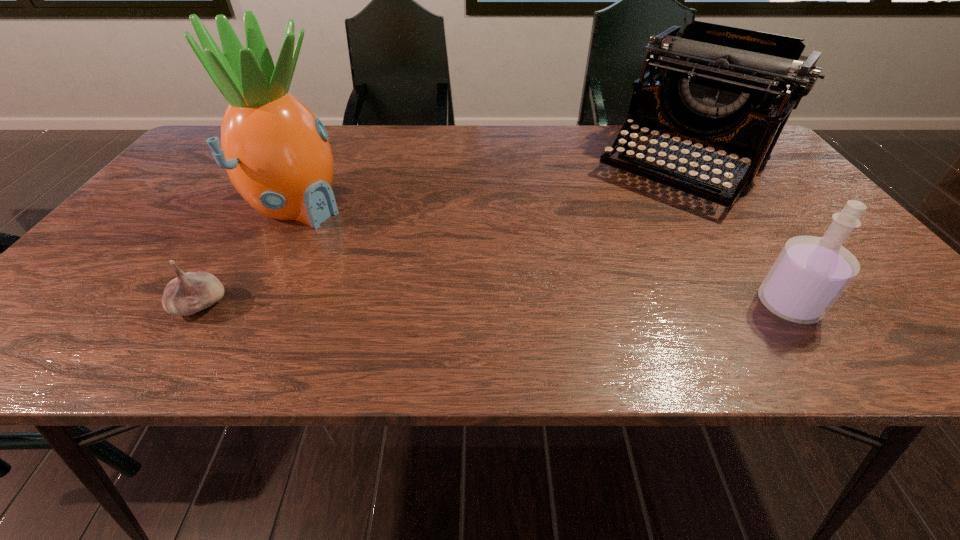
Image resolution: width=960 pixels, height=540 pixels. I want to click on vacant region between the pineapple and the garlic, so click(x=249, y=256).

The image size is (960, 540). In order to click on the closest object relative to the tallest object in this screenshot , I will do `click(191, 292)`.

You are a GUI agent. You are given a task and a screenshot of the screen. Output one action in this format:
    pyautogui.click(x=<x>, y=<y>)
    Task: Click on the object that is the third closest to the second tallest object
    This screenshot has width=960, height=540.
    Given the screenshot: What is the action you would take?
    pyautogui.click(x=191, y=292)

Locate an element on the screen. Image resolution: width=960 pixels, height=540 pixels. vacant area that satisfies the following two spatial constraints: 1. on the back side of the tallest object; 2. on the left side of the second tallest object is located at coordinates (317, 167).

The image size is (960, 540). What are the coordinates of `free location that satisfies the following two spatial constraints: 1. on the front side of the second tallest object; 2. on the left side of the third tallest object` in the screenshot? It's located at (773, 305).

This screenshot has width=960, height=540. In order to click on vacant area that satisfies the following two spatial constraints: 1. on the back side of the perfume; 2. on the left side of the garlic in this screenshot , I will do `click(201, 305)`.